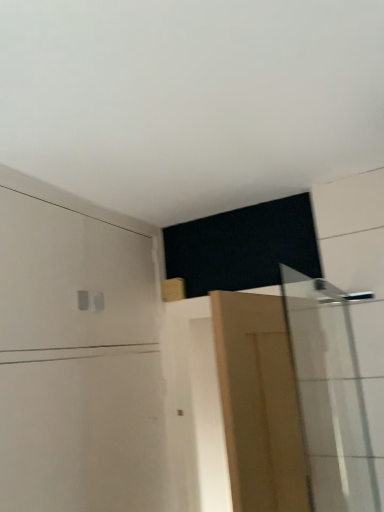
Question: Considering the positions of white matte dresser at upper left and white glossy shower door at right in the image, is white matte dresser at upper left wider or thinner than white glossy shower door at right?

Choices:
 (A) wide
 (B) thin

Answer: (A)

Question: Based on their sizes in the image, would you say white matte dresser at upper left is bigger or smaller than white glossy shower door at right?

Choices:
 (A) big
 (B) small

Answer: (A)

Question: Estimate the real-world distances between objects in this image. Which object is closer to the white glossy shower door at right?

Choices:
 (A) light brown wooden door at center
 (B) white matte dresser at upper left

Answer: (A)

Question: Which of these objects is positioned closest to the white glossy shower door at right?

Choices:
 (A) light brown wooden door at center
 (B) white matte dresser at upper left

Answer: (A)